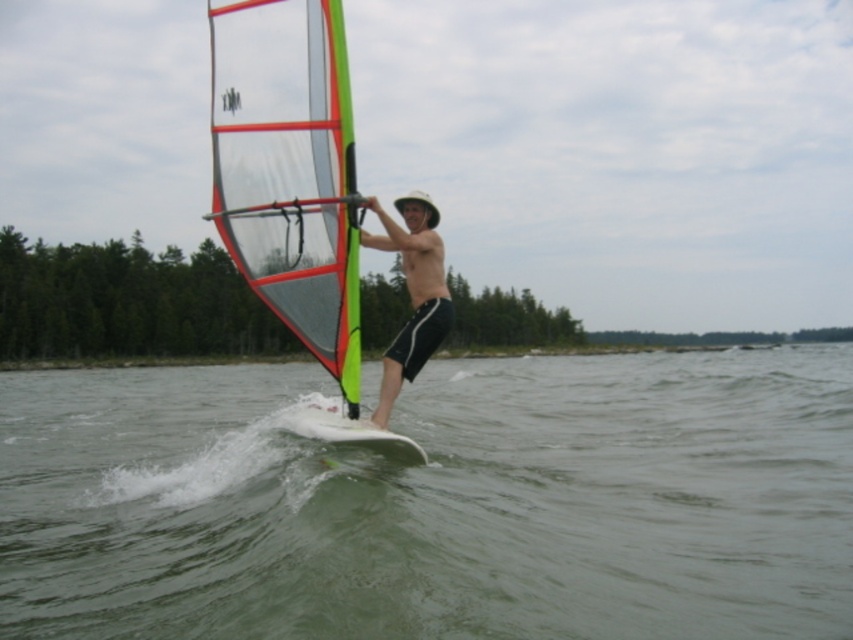
Question: Can you confirm if greenish-gray water at center is thinner than transparent plastic sail at center?

Choices:
 (A) yes
 (B) no

Answer: (B)

Question: Which point appears closest to the camera in this image?

Choices:
 (A) (648, 580)
 (B) (374, 442)
 (C) (305, 112)
 (D) (397, 196)

Answer: (A)

Question: Does greenish-gray water at center have a lesser width compared to white smooth surfboard at center?

Choices:
 (A) no
 (B) yes

Answer: (A)

Question: Which point is farther from the camera taking this photo?

Choices:
 (A) (296, 429)
 (B) (409, 275)
 (C) (177, 586)

Answer: (A)

Question: Which point appears farthest from the camera in this image?

Choices:
 (A) pyautogui.click(x=367, y=202)
 (B) pyautogui.click(x=289, y=112)

Answer: (B)

Question: Can you confirm if transparent plastic sail at center is positioned above matte black shorts at center?

Choices:
 (A) yes
 (B) no

Answer: (A)